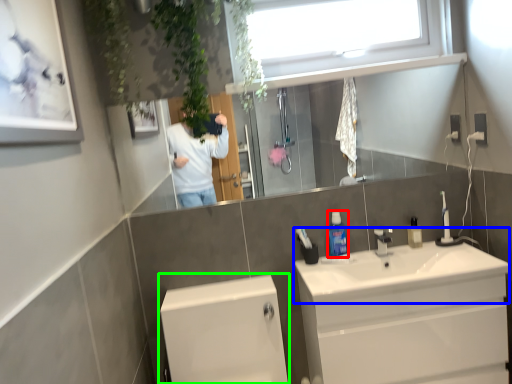
Question: Which object is positioned farthest from mouthwash (highlighted by a red box)? Select from sink (highlighted by a blue box) and bath (highlighted by a green box).

Choices:
 (A) sink
 (B) bath

Answer: (B)